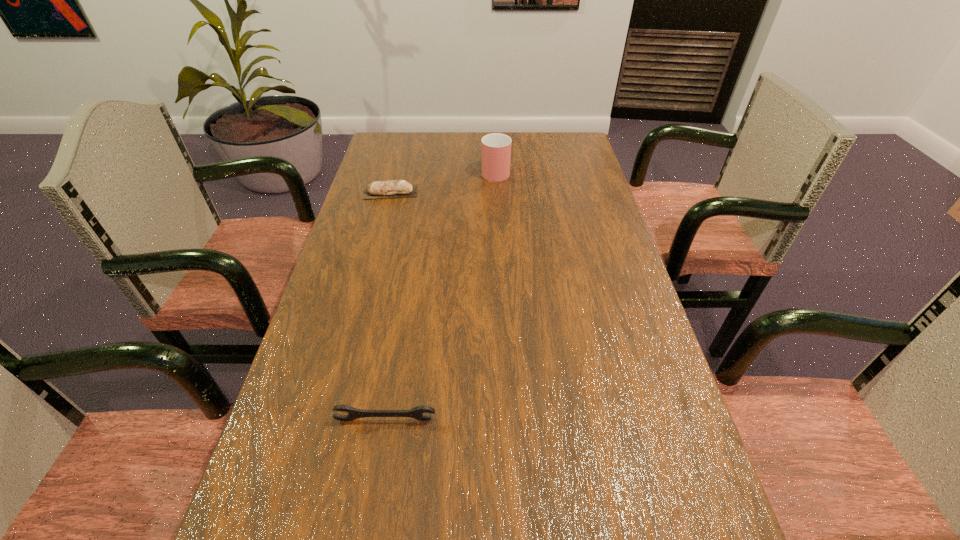
Locate an element on the screen. The width and height of the screenshot is (960, 540). cup is located at coordinates (496, 148).

This screenshot has width=960, height=540. Identify the location of the tallest object. (496, 148).

The height and width of the screenshot is (540, 960). Identify the location of the nearest object. (417, 412).

Where is `the shortest object`? This screenshot has width=960, height=540. the shortest object is located at coordinates (391, 188).

The height and width of the screenshot is (540, 960). What are the coordinates of `the second nearest object` in the screenshot? It's located at (391, 188).

This screenshot has height=540, width=960. I want to click on vacant space situated on the side of the cup with the handle, so click(x=493, y=133).

Locate an element on the screen. This screenshot has width=960, height=540. free space located 0.130m on the side of the cup with the handle is located at coordinates (494, 143).

At what (x,y) coordinates should I click in order to perform the action: click on free space located 0.160m on the side of the cup with the handle. Please return your answer as a coordinate pair (x, y). Looking at the image, I should click on (494, 139).

Image resolution: width=960 pixels, height=540 pixels. I want to click on vacant area situated 0.160m on the open ends of the nearest object, so click(x=370, y=514).

You are a GUI agent. You are given a task and a screenshot of the screen. Output one action in this format:
    pyautogui.click(x=<x>, y=<y>)
    Task: Click on the free space located 0.370m on the right of the shortest object
    
    Given the screenshot: What is the action you would take?
    [x=536, y=192]